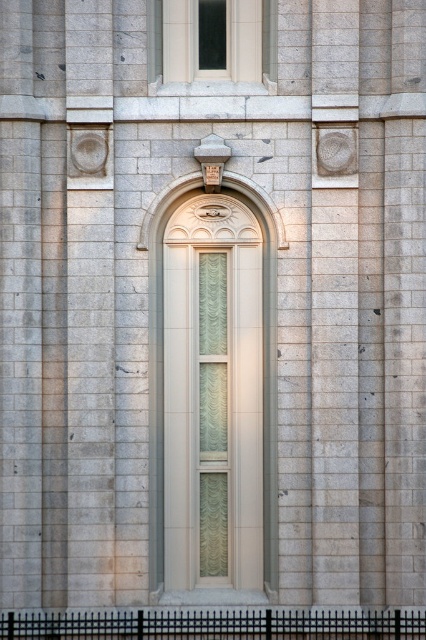
Question: Which point is farther to the camera?

Choices:
 (A) pyautogui.click(x=241, y=10)
 (B) pyautogui.click(x=164, y=413)

Answer: (A)

Question: Can you confirm if matte cream glass door at center is positioned to the right of matte glass window at upper center?

Choices:
 (A) no
 (B) yes

Answer: (B)

Question: Is matte cream glass door at center below matte glass window at upper center?

Choices:
 (A) yes
 (B) no

Answer: (A)

Question: Which object appears farthest from the camera in this image?

Choices:
 (A) matte glass window at upper center
 (B) matte cream glass door at center

Answer: (A)

Question: Is matte cream glass door at center further to the viewer compared to matte glass window at upper center?

Choices:
 (A) no
 (B) yes

Answer: (A)